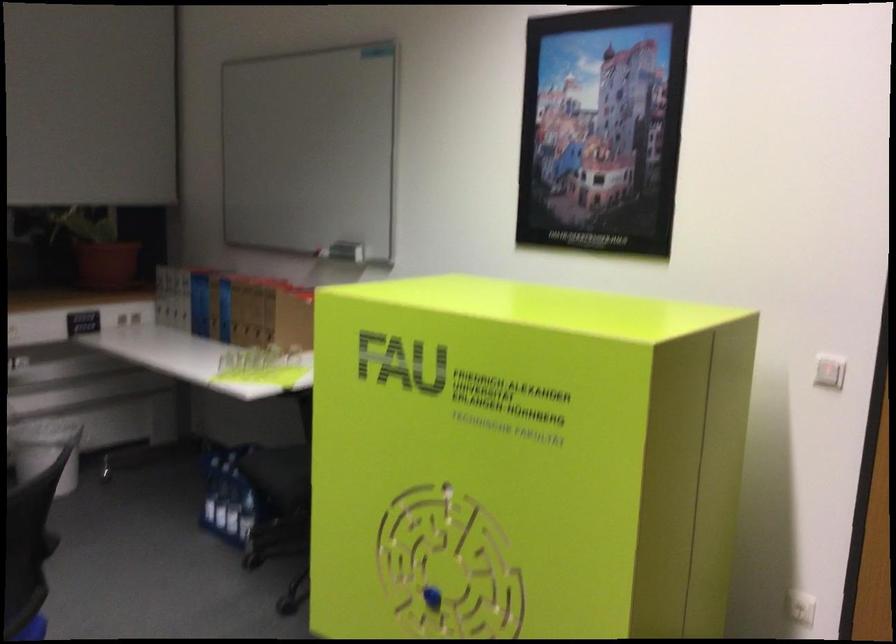
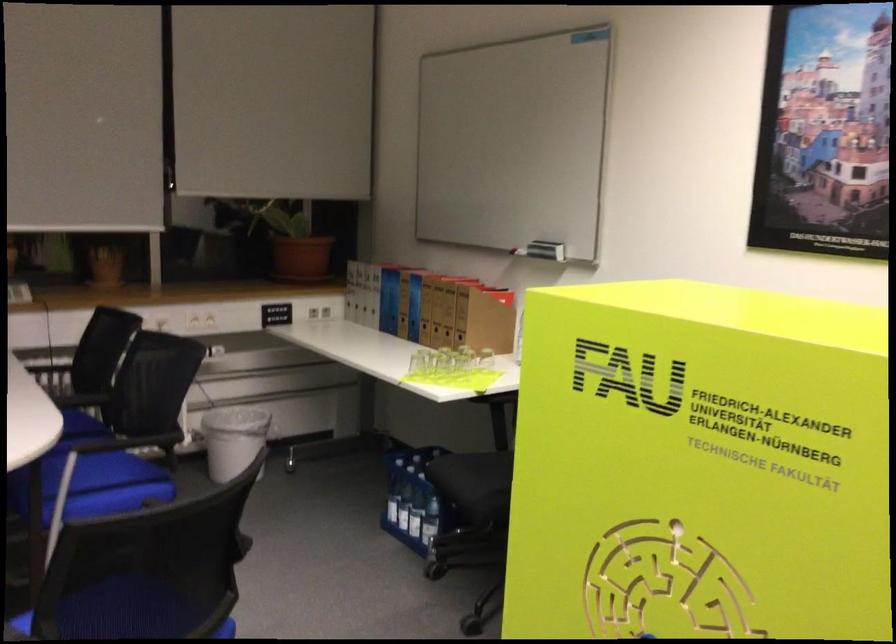
Where in the second image is the point corresponding to (x=248, y=512) from the first image?

(429, 520)